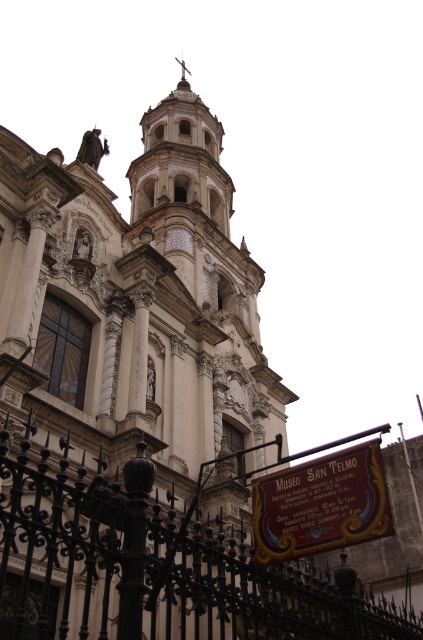
You are standing in front of the grand building and notice two points marked on the image. The first point is at coordinates point[129,620] and the second is at point[356,506]. Which point is closer to your current position?

Point[129,620] is closer to the viewer than point[356,506].

What is the significance of the point at coordinates (153,564) in the image?

The point at coordinates (153,564) indicates the location of the black wrought iron fence at lower center.